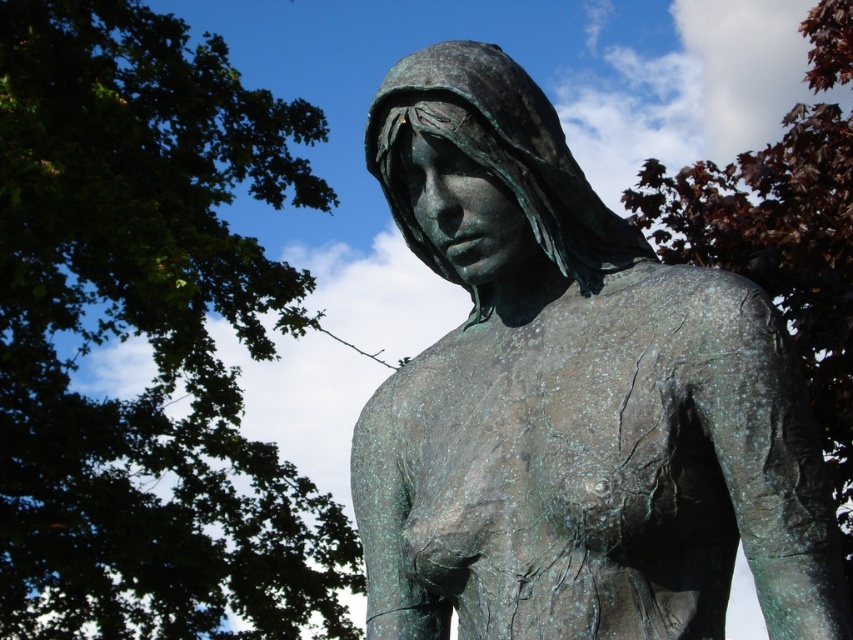
Question: Among these points, which one is farthest from the camera?

Choices:
 (A) (660, 552)
 (B) (822, 365)
 (C) (340, 611)

Answer: (C)

Question: From the image, what is the correct spatial relationship of green patina statue at center in relation to dark red leaves at upper right?

Choices:
 (A) above
 (B) below

Answer: (A)

Question: Is green patina statue at center positioned in front of green leafy tree at upper left?

Choices:
 (A) no
 (B) yes

Answer: (B)

Question: Where is green leafy tree at upper left located in relation to dark red leaves at upper right in the image?

Choices:
 (A) right
 (B) left

Answer: (B)

Question: Which point is closer to the camera?

Choices:
 (A) green leafy tree at upper left
 (B) dark red leaves at upper right
 (C) green patina statue at center

Answer: (C)

Question: Which point is closer to the camera taking this photo?

Choices:
 (A) (769, 260)
 (B) (276, 294)

Answer: (A)